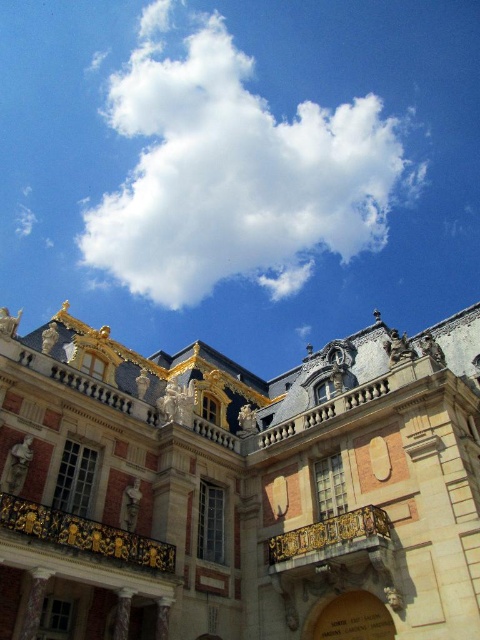
Does gold ornate railing at center come behind gold ornate balcony at center?

That is False.

Which is behind, point (171, 561) or point (369, 540)?

The point (171, 561) is behind.

You are a GUI agent. You are given a task and a screenshot of the screen. Output one action in this format:
    pyautogui.click(x=<x>, y=<y>)
    Task: Click on the gold ornate railing at center
    The height and width of the screenshot is (640, 480).
    Given the screenshot: What is the action you would take?
    pyautogui.click(x=84, y=534)

Can you confirm if golden ornate balcony at upper center is thinner than gold ornate railing at center?

No.

Which is below, golden ornate balcony at upper center or gold ornate railing at center?

gold ornate railing at center is lower down.

What do you see at coordinates (240, 488) in the screenshot? I see `golden ornate balcony at upper center` at bounding box center [240, 488].

Identify the location of golden ornate balcony at upper center. (240, 488).

Which of these two, white fluffy cloud at upper center or gold ornate balcony at center, stands shorter?

With less height is gold ornate balcony at center.

Who is higher up, white fluffy cloud at upper center or gold ornate balcony at center?

white fluffy cloud at upper center is higher up.

Is point (131, 182) positioned before point (373, 506)?

No, (131, 182) is behind (373, 506).

Locate an element on the screen. white fluffy cloud at upper center is located at coordinates pyautogui.click(x=235, y=173).